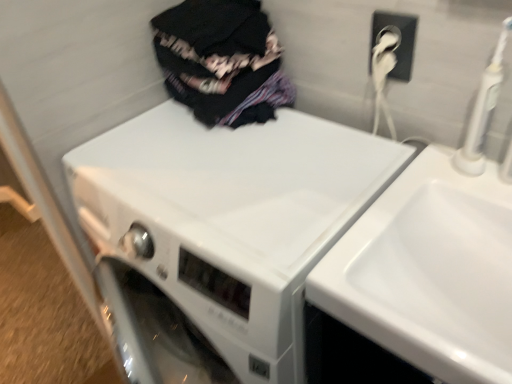
Image resolution: width=512 pixels, height=384 pixels. Identify the location of vacant space to the left of dark fabric clothes at upper center. [133, 139].